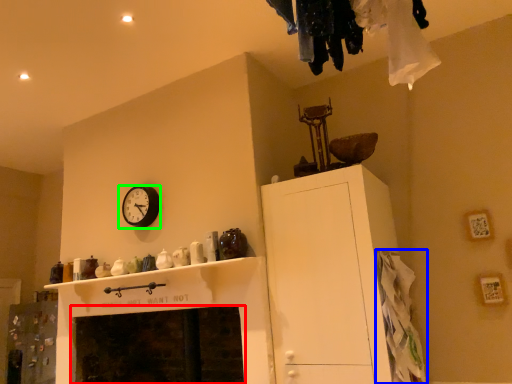
Question: Considering the real-world distances, which object is farthest from fireplace (highlighted by a red box)? clothing (highlighted by a blue box) or wall clock (highlighted by a green box)?

Choices:
 (A) clothing
 (B) wall clock

Answer: (A)